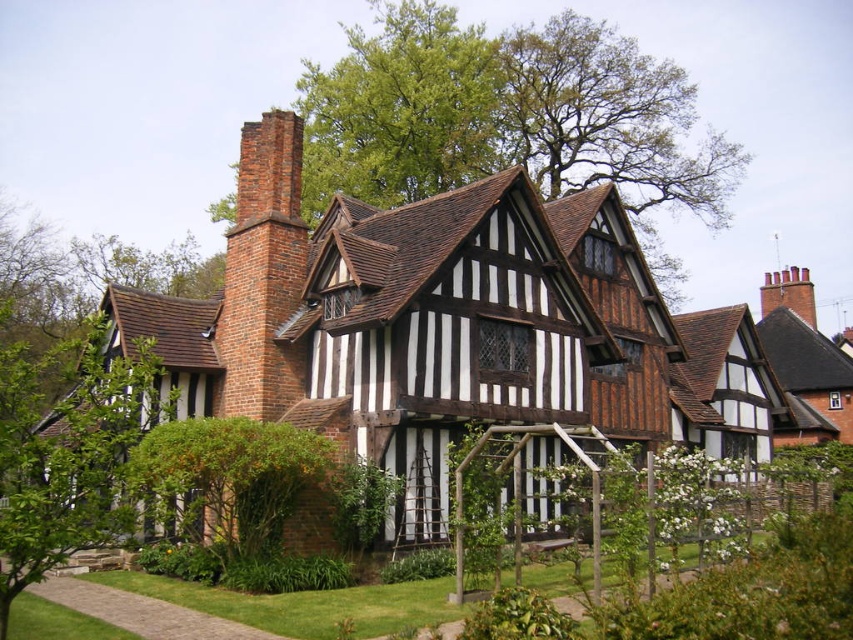
Question: Estimate the real-world distances between objects in this image. Which object is closer to the green leafy bush at left?

Choices:
 (A) green leafy bush at lower left
 (B) brick chimney at upper right
 (C) green leafy tree at upper center

Answer: (A)

Question: Does green leafy tree at upper center appear on the left side of brick chimney at upper left?

Choices:
 (A) yes
 (B) no

Answer: (B)

Question: Which point is farther to the camera?

Choices:
 (A) (515, 42)
 (B) (206, 474)

Answer: (A)

Question: Is green leafy tree at upper center to the left of brick chimney at upper right from the viewer's perspective?

Choices:
 (A) yes
 (B) no

Answer: (A)

Question: Is brick chimney at upper left to the left of brick chimney at upper right from the viewer's perspective?

Choices:
 (A) yes
 (B) no

Answer: (A)

Question: Which of the following is the closest to the observer?

Choices:
 (A) (264, 339)
 (B) (165, 436)
 (C) (804, 292)
 (D) (57, 490)

Answer: (D)